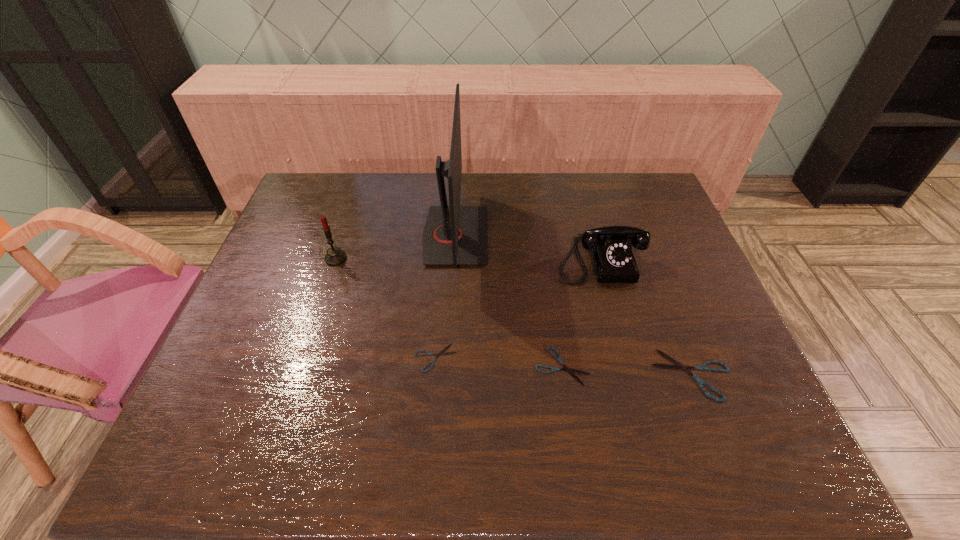
Locate an element on the screen. The image size is (960, 540). free space between the shortest object and the third tallest object is located at coordinates (517, 308).

The image size is (960, 540). Find the location of `vacant point located between the shortest object and the second shortest shears`. vacant point located between the shortest object and the second shortest shears is located at coordinates (498, 362).

The image size is (960, 540). Identify the location of free point between the candle and the second tallest shears. (449, 312).

Where is `vacant space that's between the fourth tallest object and the monitor`? The height and width of the screenshot is (540, 960). vacant space that's between the fourth tallest object and the monitor is located at coordinates (574, 305).

Where is `object that is the third closest to the fourth tallest object`? The width and height of the screenshot is (960, 540). object that is the third closest to the fourth tallest object is located at coordinates (454, 235).

Choose which object is the second nearest neighbor to the leftmost object. Please provide its 2D coordinates. Your answer should be formatted as a tuple, i.e. [(x, y)], where the tuple contains the x and y coordinates of a point satisfying the conditions above.

[(428, 353)]

Identify which shears is the nearest to the fourth tallest object. Please provide its 2D coordinates. Your answer should be formatted as a tuple, i.e. [(x, y)], where the tuple contains the x and y coordinates of a point satisfying the conditions above.

[(570, 371)]

This screenshot has height=540, width=960. Find the location of `shears that is the nearest to the second shears from left to right`. shears that is the nearest to the second shears from left to right is located at coordinates (678, 365).

You are a GUI agent. You are given a task and a screenshot of the screen. Output one action in this format:
    pyautogui.click(x=<x>, y=<y>)
    Task: Click on the vacant area that satisfies the following two spatial constraints: 1. on the screen side of the monitor; 2. on the front side of the leftmost object
    The height and width of the screenshot is (540, 960).
    Given the screenshot: What is the action you would take?
    pyautogui.click(x=454, y=259)

The height and width of the screenshot is (540, 960). I want to click on free space that satisfies the following two spatial constraints: 1. on the screen side of the tallest object; 2. on the left side of the second tallest shears, so click(447, 366).